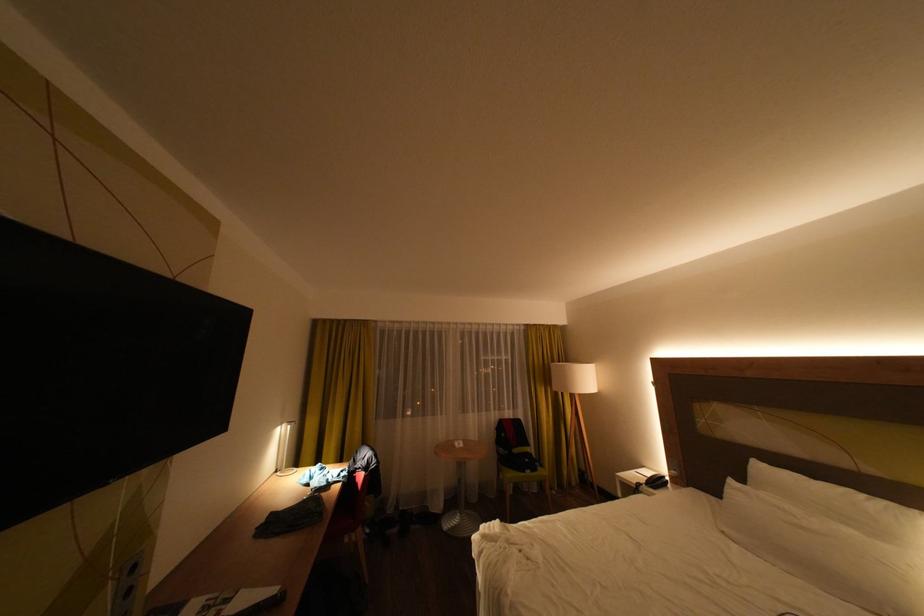
This screenshot has height=616, width=924. Identify the location of black electrical outlet. (129, 591).